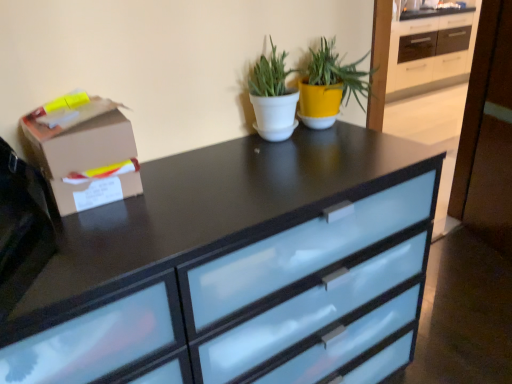
Question: Is satin black chest of drawers at center taller or shorter than white matte pot at center, the second houseplant viewed from the right?

Choices:
 (A) tall
 (B) short

Answer: (A)

Question: Does point (13, 355) appear closer or farther from the camera than point (266, 130)?

Choices:
 (A) closer
 (B) farther

Answer: (A)

Question: Considering the real-world distances, which object is closest to the satin black chest of drawers at center?

Choices:
 (A) brown cardboard box at left
 (B) white matte pot at center, the second houseplant viewed from the right
 (C) yellow matte pot at upper center, the 2th houseplant positioned from the left

Answer: (A)

Question: Estimate the real-world distances between objects in this image. Which object is farther from the brown cardboard box at left?

Choices:
 (A) satin black chest of drawers at center
 (B) yellow matte pot at upper center, the 2th houseplant positioned from the left
 (C) white matte pot at center, which is counted as the first houseplant, starting from the left

Answer: (B)